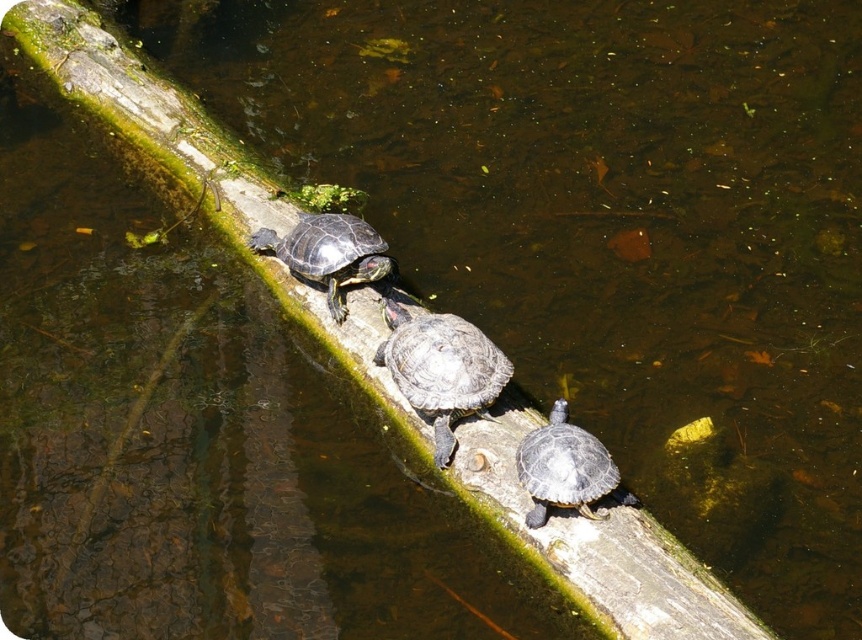
Question: Which point is closer to the camera?

Choices:
 (A) smooth gray tortoise at center
 (B) shiny dark green tortoise at center

Answer: (B)

Question: Can you confirm if shiny dark green tortoise at center is bigger than shiny dark green tortoise at upper center?

Choices:
 (A) no
 (B) yes

Answer: (A)

Question: Is smooth gray tortoise at center thinner than shiny dark green tortoise at center?

Choices:
 (A) no
 (B) yes

Answer: (A)

Question: Considering the relative positions of shiny dark green tortoise at center and shiny dark green tortoise at upper center in the image provided, where is shiny dark green tortoise at center located with respect to shiny dark green tortoise at upper center?

Choices:
 (A) below
 (B) above

Answer: (A)

Question: Which point is closer to the camera?

Choices:
 (A) (564, 464)
 (B) (372, 358)

Answer: (A)

Question: Based on their relative distances, which object is nearer to the shiny dark green tortoise at upper center?

Choices:
 (A) shiny dark green tortoise at center
 (B) smooth gray tortoise at center

Answer: (B)